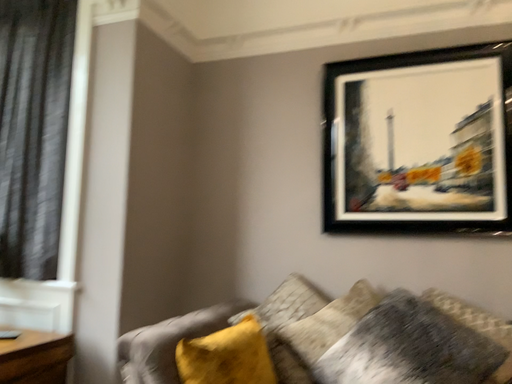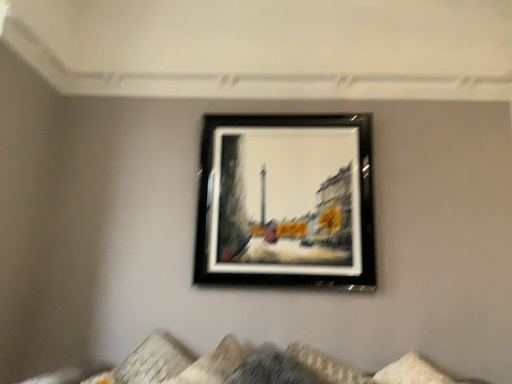
Question: Which way did the camera rotate in the video?

Choices:
 (A) rotated upward
 (B) rotated downward

Answer: (A)